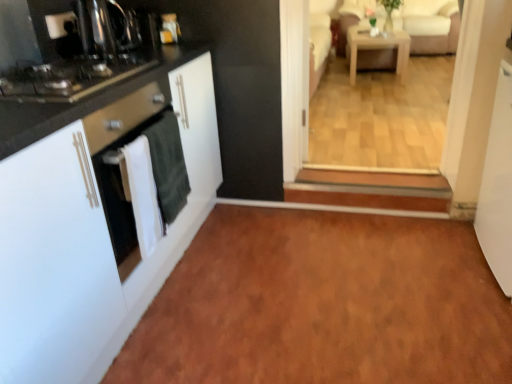
Question: Looking at their shapes, would you say white matte cabinet at left is wider or thinner than black glass stove at left?

Choices:
 (A) thin
 (B) wide

Answer: (B)

Question: Considering the positions of point (53, 380) and point (75, 84), is point (53, 380) closer or farther from the camera than point (75, 84)?

Choices:
 (A) closer
 (B) farther

Answer: (A)

Question: Estimate the real-world distances between objects in this image. Which object is closer to the black glass stove at left?

Choices:
 (A) beige fabric couch at upper right
 (B) white glossy refrigerator at right
 (C) brown laminate floor at lower center
 (D) white matte cabinet at left
 (E) light wood/wooden table at center

Answer: (D)

Question: Considering the real-world distances, which object is farthest from the black glass stove at left?

Choices:
 (A) light wood/wooden table at center
 (B) white glossy refrigerator at right
 (C) white matte cabinet at left
 (D) beige fabric couch at upper right
 (E) brown laminate floor at lower center

Answer: (D)